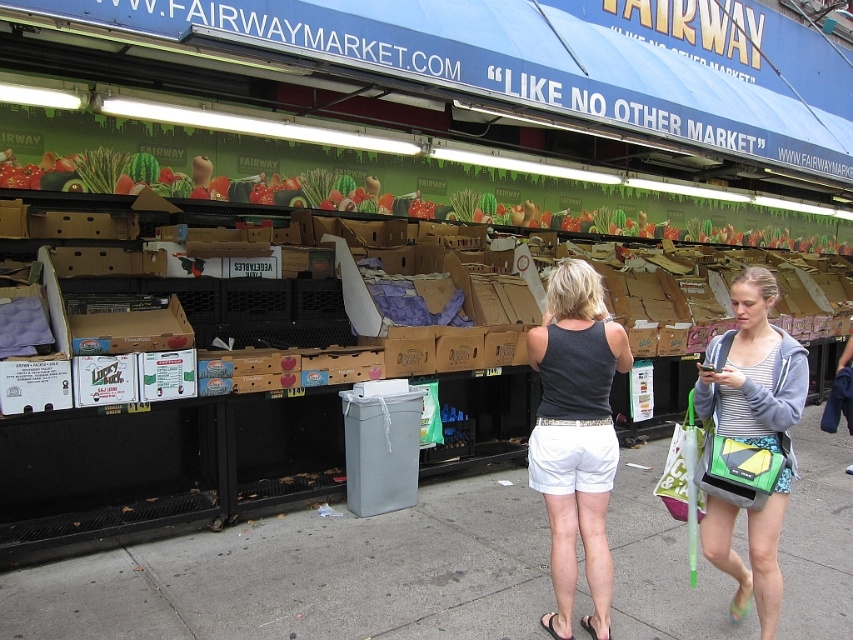
Question: Which point is farther from the camera taking this photo?

Choices:
 (A) (527, 560)
 (B) (115, 172)
 (C) (585, 390)

Answer: (B)

Question: Does dark gray tank top at center appear on the right side of striped fabric hoodie at lower right?

Choices:
 (A) no
 (B) yes

Answer: (A)

Question: Does gray concrete pavement at lower center appear on the right side of striped fabric hoodie at lower right?

Choices:
 (A) no
 (B) yes

Answer: (A)

Question: Which point appears farthest from the camera in this image?

Choices:
 (A) (554, 380)
 (B) (782, 376)

Answer: (A)

Question: Which object appears farthest from the camera in this image?

Choices:
 (A) striped fabric hoodie at lower right
 (B) gray concrete pavement at lower center

Answer: (B)

Question: Is gray concrete pavement at lower center wider than dark gray tank top at center?

Choices:
 (A) yes
 (B) no

Answer: (A)